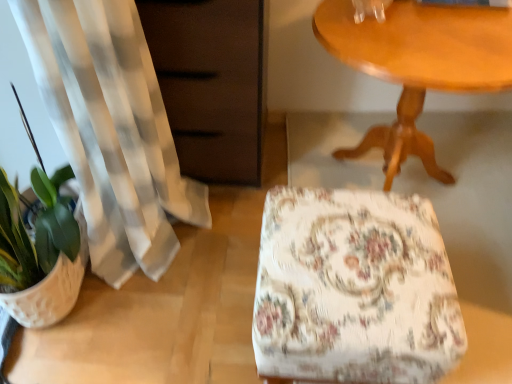
Find the location of a particular element. The height and width of the screenshot is (384, 512). free point above floral fabric ottoman at center (from a real-world perspective) is located at coordinates (364, 262).